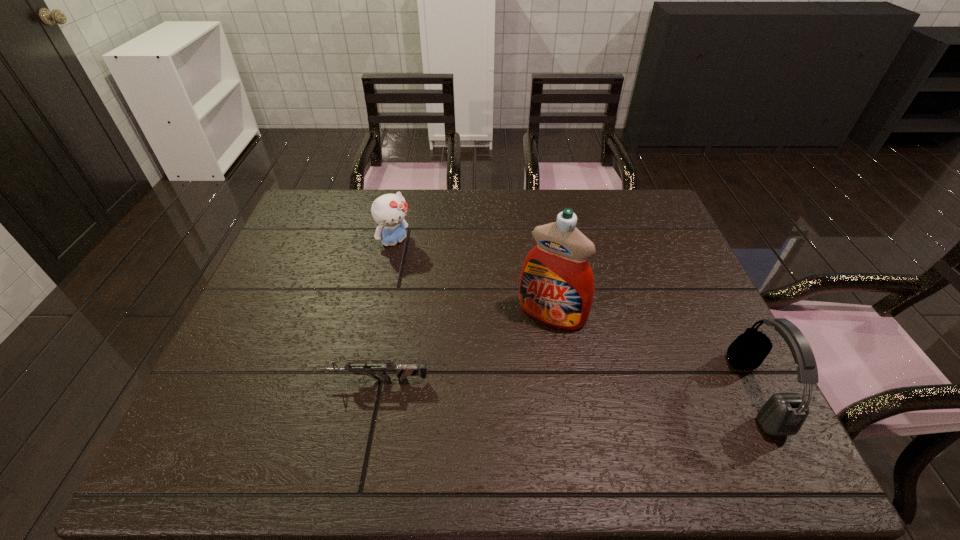
This screenshot has width=960, height=540. Identify the location of vacant space that is in between the farthest object and the gun. pos(386,311).

I want to click on vacant region between the kitten and the shortest object, so click(x=386, y=311).

Where is `vacant space in between the shortest object and the second tallest object`? vacant space in between the shortest object and the second tallest object is located at coordinates 566,386.

In order to click on vacant region between the rightmost object and the gun in this screenshot , I will do `click(566, 386)`.

Locate an element on the screen. This screenshot has height=540, width=960. free space that is in between the second shortest object and the third nearest object is located at coordinates (474, 279).

The width and height of the screenshot is (960, 540). What are the coordinates of `object that is the third closest to the second shortest object` in the screenshot? It's located at (783, 414).

Select which object is the third closest to the kitten. Please provide its 2D coordinates. Your answer should be formatted as a tuple, i.e. [(x, y)], where the tuple contains the x and y coordinates of a point satisfying the conditions above.

[(783, 414)]

In order to click on free location that satisfies the following two spatial constraints: 1. on the front side of the detergent; 2. on the headband of the rightmost object in this screenshot , I will do `click(564, 393)`.

You are a GUI agent. You are given a task and a screenshot of the screen. Output one action in this format:
    pyautogui.click(x=<x>, y=<y>)
    Task: Click on the free location that satisfies the following two spatial constraints: 1. on the front side of the tallest object; 2. on the right side of the farthest object
    Image resolution: width=960 pixels, height=540 pixels.
    Given the screenshot: What is the action you would take?
    (x=381, y=314)

The width and height of the screenshot is (960, 540). In order to click on vacant space that satisfies the following two spatial constraints: 1. on the front side of the farthest object; 2. on the headband of the third shortest object in this screenshot , I will do `click(364, 393)`.